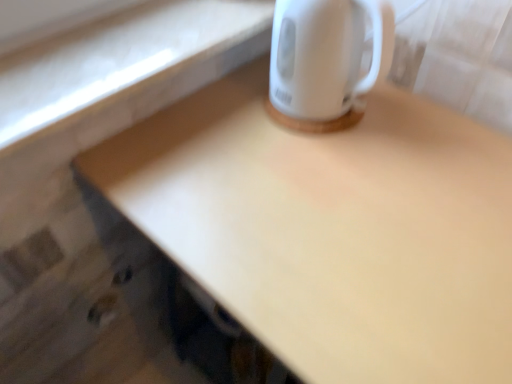
What are the coordinates of `free space above matte white desk at upper right (from a real-world perspective)` in the screenshot? It's located at 350,188.